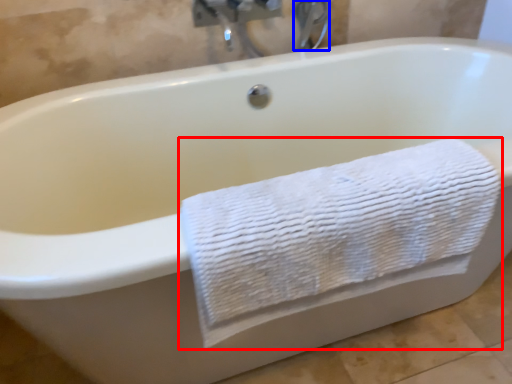
Question: Which object is further to the camera taking this photo, towel (highlighted by a red box) or faucet (highlighted by a blue box)?

Choices:
 (A) towel
 (B) faucet

Answer: (B)